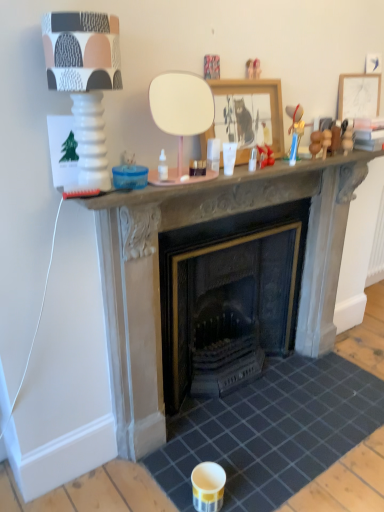
Question: From a real-world perspective, is stone fireplace at center beneath matte white lamp at upper left?

Choices:
 (A) yes
 (B) no

Answer: (A)

Question: Can you confirm if stone fireplace at center is thinner than matte white lamp at upper left?

Choices:
 (A) yes
 (B) no

Answer: (B)

Question: Are stone fireplace at center and matte white lamp at upper left located far from each other?

Choices:
 (A) yes
 (B) no

Answer: (B)

Question: Is stone fireplace at center turned away from matte white lamp at upper left?

Choices:
 (A) no
 (B) yes

Answer: (A)

Question: Is stone fireplace at center shorter than matte white lamp at upper left?

Choices:
 (A) no
 (B) yes

Answer: (A)

Question: Considering the positions of matte white lamp at upper left and wooden framed picture at center, which appears as the first picture frame when viewed from the left, in the image, is matte white lamp at upper left bigger or smaller than wooden framed picture at center, which appears as the first picture frame when viewed from the left,?

Choices:
 (A) small
 (B) big

Answer: (B)

Question: From a real-world perspective, is matte white lamp at upper left above or below wooden framed picture at center, which appears as the 2th picture frame when viewed from the right?

Choices:
 (A) above
 (B) below

Answer: (A)

Question: From the image's perspective, relative to wooden framed picture at center, which appears as the 2th picture frame when viewed from the right, is matte white lamp at upper left above or below?

Choices:
 (A) above
 (B) below

Answer: (B)

Question: Which is correct: matte white lamp at upper left is inside wooden framed picture at center, which appears as the first picture frame when viewed from the front, or outside of it?

Choices:
 (A) outside
 (B) inside

Answer: (A)

Question: Which is correct: wooden framed picture at center, which appears as the first picture frame when viewed from the left, is inside white glossy coffee cup at upper center, or outside of it?

Choices:
 (A) outside
 (B) inside

Answer: (A)

Question: From a real-world perspective, is wooden framed picture at center, which appears as the 2th picture frame when viewed from the right, physically located above or below white glossy coffee cup at upper center?

Choices:
 (A) below
 (B) above

Answer: (B)

Question: In terms of width, does wooden framed picture at center, which ranks as the 2th picture frame in back-to-front order, look wider or thinner when compared to white glossy coffee cup at upper center?

Choices:
 (A) thin
 (B) wide

Answer: (B)

Question: Does point (244, 119) appear closer or farther from the camera than point (225, 174)?

Choices:
 (A) farther
 (B) closer

Answer: (A)

Question: Would you say wooden framed picture at center, which appears as the 2th picture frame when viewed from the right, is inside or outside stone fireplace at center?

Choices:
 (A) outside
 (B) inside

Answer: (A)

Question: From the image's perspective, relative to stone fireplace at center, is wooden framed picture at center, which appears as the first picture frame when viewed from the front, above or below?

Choices:
 (A) below
 (B) above

Answer: (B)